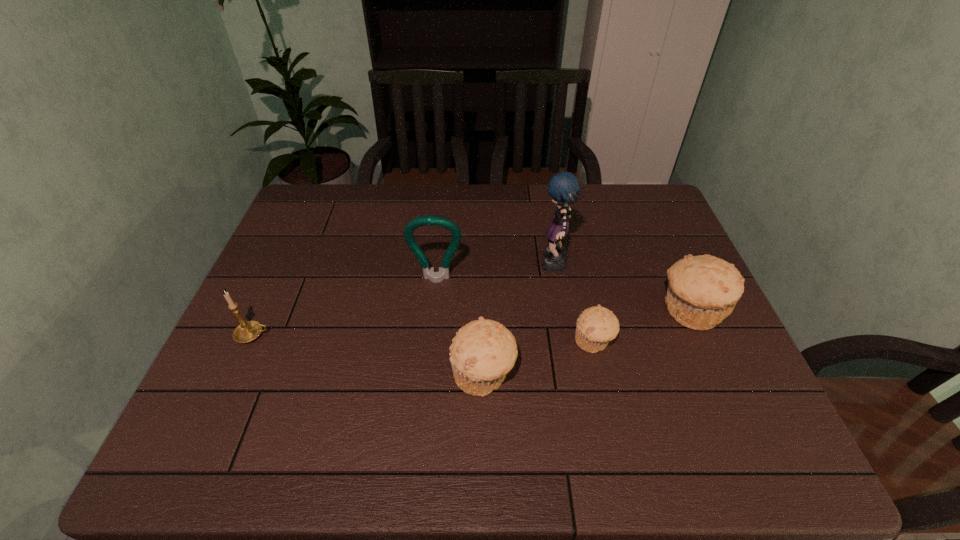
Where is `the leftmost muffin`? This screenshot has width=960, height=540. the leftmost muffin is located at coordinates (483, 351).

In order to click on the shortest object in this screenshot , I will do `click(596, 326)`.

Locate an element on the screen. The image size is (960, 540). the shortest muffin is located at coordinates (596, 326).

The image size is (960, 540). In order to click on the rightmost muffin in this screenshot , I will do coord(703,290).

Locate an element on the screen. the tallest object is located at coordinates (563, 187).

Locate an element on the screen. candle holder is located at coordinates (248, 331).

This screenshot has height=540, width=960. Find the location of `the second tallest object`. the second tallest object is located at coordinates (429, 220).

Identify the location of vacant area situated on the back of the second tallest muffin. (483, 294).

The width and height of the screenshot is (960, 540). Identify the location of free space located 0.310m on the left of the second muffin from left to right. (446, 341).

The width and height of the screenshot is (960, 540). I want to click on vacant space located 0.050m on the front of the rightmost object, so click(709, 355).